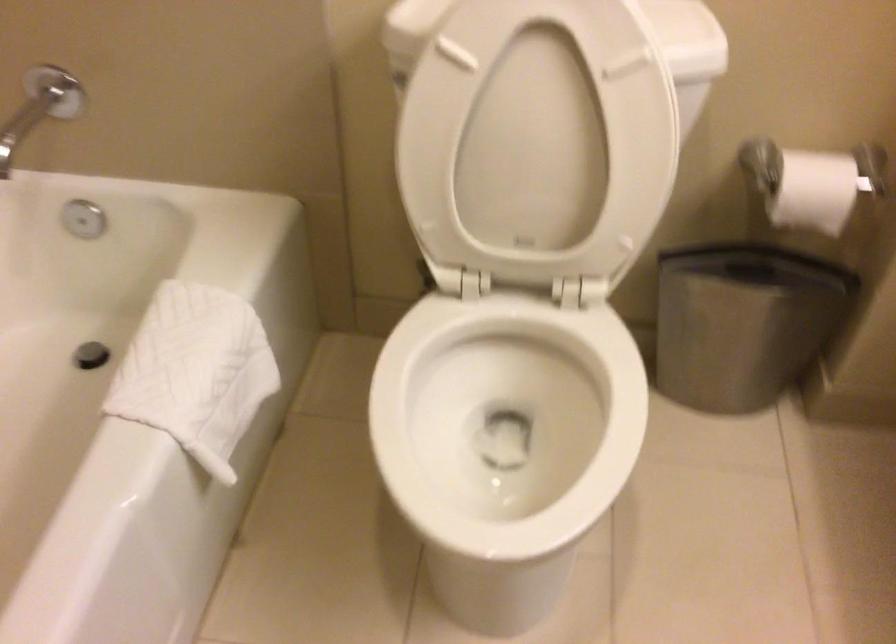
Locate an element on the screen. The height and width of the screenshot is (644, 896). white toilet seat lid is located at coordinates pos(538,140).